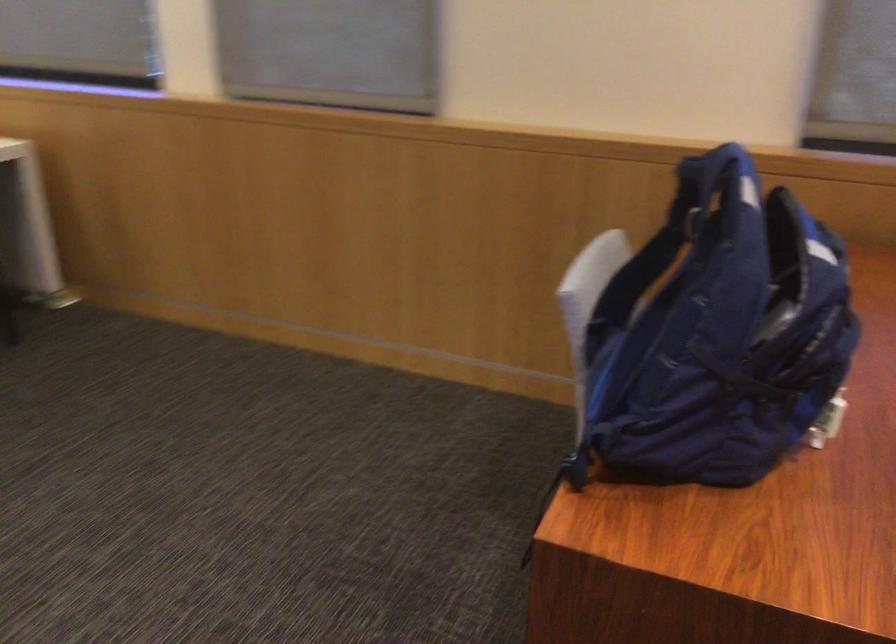
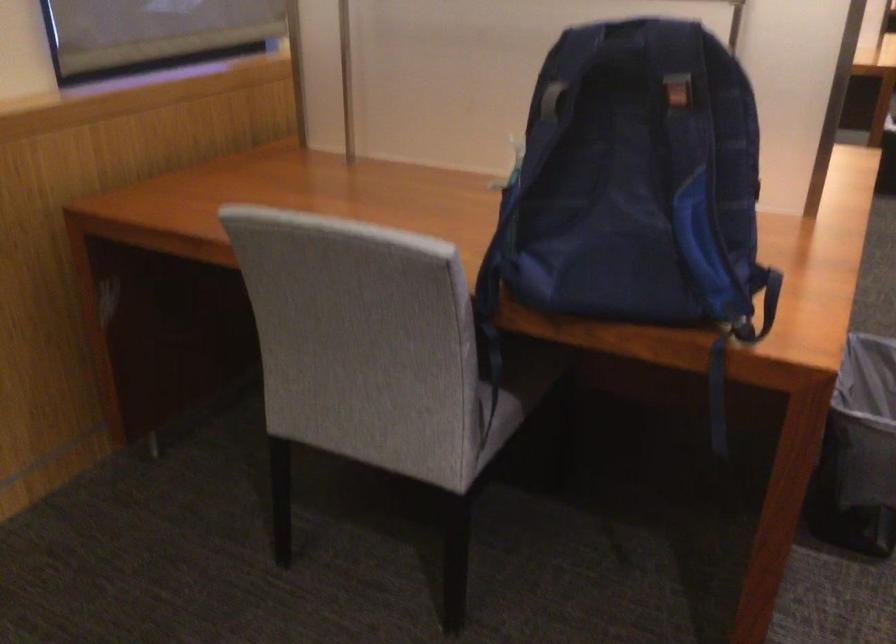
Question: I am providing you with two images of the same scene from different viewpoints. Please identify which objects are invisible in image2.

Choices:
 (A) backpack buckle
 (B) blue backpack strap
 (C) backpack handle
 (D) none of these

Answer: (D)